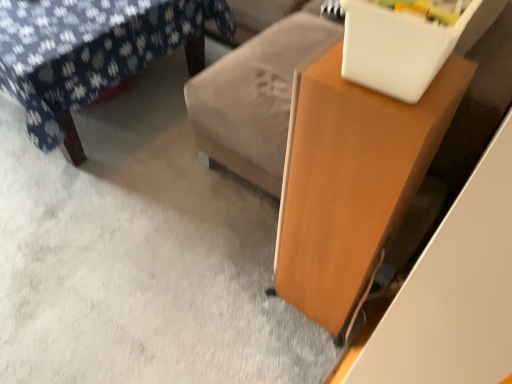
Question: From the image's perspective, is velvet floral-patterned ottoman at upper left under wooden table at right?

Choices:
 (A) no
 (B) yes

Answer: (A)

Question: Can you confirm if velvet floral-patterned ottoman at upper left is wider than wooden table at right?

Choices:
 (A) yes
 (B) no

Answer: (A)

Question: From a real-world perspective, is velvet floral-patterned ottoman at upper left beneath wooden table at right?

Choices:
 (A) no
 (B) yes

Answer: (B)

Question: From a real-world perspective, is velvet floral-patterned ottoman at upper left over wooden table at right?

Choices:
 (A) no
 (B) yes

Answer: (A)

Question: Is velvet floral-patterned ottoman at upper left completely or partially outside of wooden table at right?

Choices:
 (A) no
 (B) yes

Answer: (B)

Question: Is velvet floral-patterned ottoman at upper left oriented towards wooden table at right?

Choices:
 (A) yes
 (B) no

Answer: (B)

Question: Does wooden table at right have a larger size compared to velvet floral-patterned ottoman at upper left?

Choices:
 (A) yes
 (B) no

Answer: (B)

Question: Is wooden table at right positioned with its back to velvet floral-patterned ottoman at upper left?

Choices:
 (A) no
 (B) yes

Answer: (A)

Question: From the image's perspective, is wooden table at right on velvet floral-patterned ottoman at upper left?

Choices:
 (A) yes
 (B) no

Answer: (B)

Question: Is wooden table at right not within velvet floral-patterned ottoman at upper left?

Choices:
 (A) no
 (B) yes

Answer: (B)

Question: Is wooden table at right taller than velvet floral-patterned ottoman at upper left?

Choices:
 (A) yes
 (B) no

Answer: (A)

Question: Is wooden table at right facing towards velvet floral-patterned ottoman at upper left?

Choices:
 (A) no
 (B) yes

Answer: (B)

Question: From their relative heights in the image, would you say wooden table at right is taller or shorter than velvet floral-patterned ottoman at upper left?

Choices:
 (A) short
 (B) tall

Answer: (B)